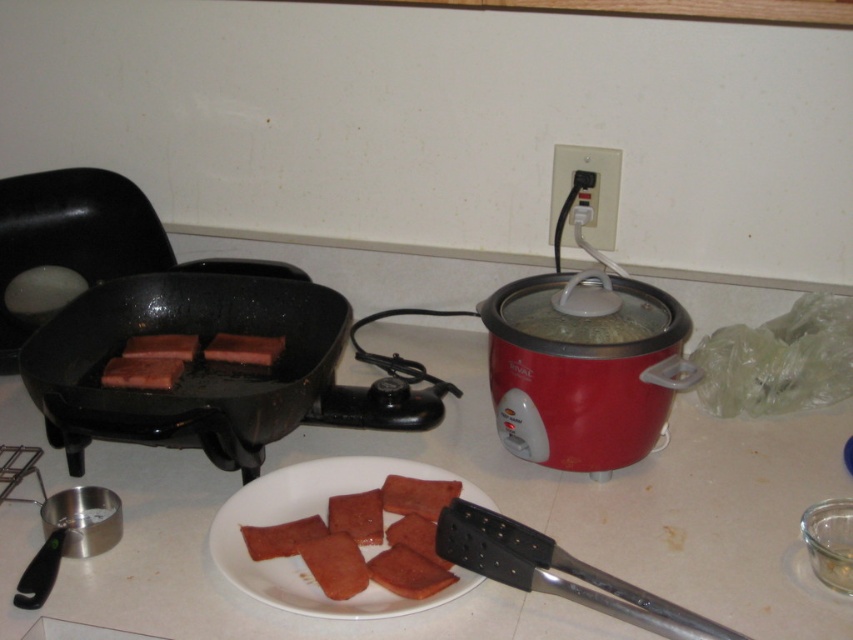
Question: From the image, what is the correct spatial relationship of pink matte/slightly glossy plate at center in relation to slightly crispy pinkish-brown ham at center?

Choices:
 (A) left
 (B) right

Answer: (A)

Question: Considering the real-world distances, which object is farthest from the pink matte ham at center?

Choices:
 (A) brown matte hot dog at center
 (B) slightly glossy pinkish-brown rectangular slices at center

Answer: (A)

Question: Which point appears closest to the camera in this image?

Choices:
 (A) (x=408, y=483)
 (B) (x=405, y=547)
 (C) (x=146, y=337)
 (D) (x=675, y=355)

Answer: (B)

Question: Is pink matte/slightly glossy plate at center to the left of pinkish matte ham at center from the viewer's perspective?

Choices:
 (A) no
 (B) yes

Answer: (B)

Question: Among these points, which one is nearest to the camera?

Choices:
 (A) (347, 552)
 (B) (369, 604)

Answer: (B)

Question: Does slightly crispy pinkish-brown ham at center appear over slightly glossy pinkish-brown rectangular slices at center?

Choices:
 (A) no
 (B) yes

Answer: (A)